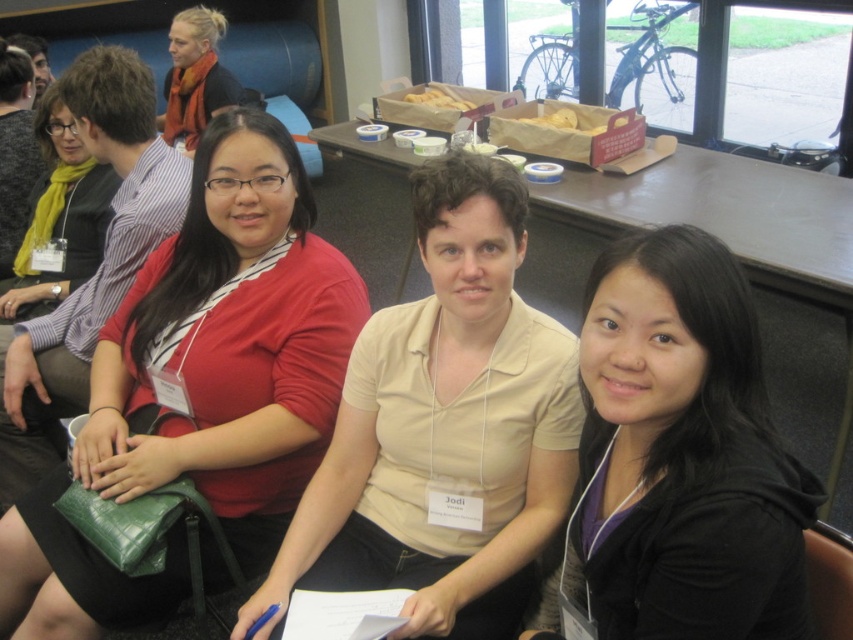
Question: Among these objects, which one is farthest from the camera?

Choices:
 (A) matte red sweater at center
 (B) smooth wooden table at center
 (C) black matte jacket at lower right
 (D) matte orange scarf at upper left

Answer: (D)

Question: Does beige cotton shirt at center appear over matte orange scarf at upper left?

Choices:
 (A) no
 (B) yes

Answer: (A)

Question: Which of these objects is positioned farthest from the matte red sweater at center?

Choices:
 (A) beige cotton shirt at center
 (B) black matte jacket at lower right

Answer: (B)

Question: Considering the relative positions of beige cotton shirt at center and black matte jacket at lower right in the image provided, where is beige cotton shirt at center located with respect to black matte jacket at lower right?

Choices:
 (A) right
 (B) left

Answer: (B)

Question: Which of the following is the farthest from the observer?

Choices:
 (A) smooth wooden table at center
 (B) black matte jacket at lower right
 (C) matte red sweater at center
 (D) matte orange scarf at upper left

Answer: (D)

Question: Does matte red sweater at center have a greater width compared to smooth wooden table at center?

Choices:
 (A) yes
 (B) no

Answer: (A)